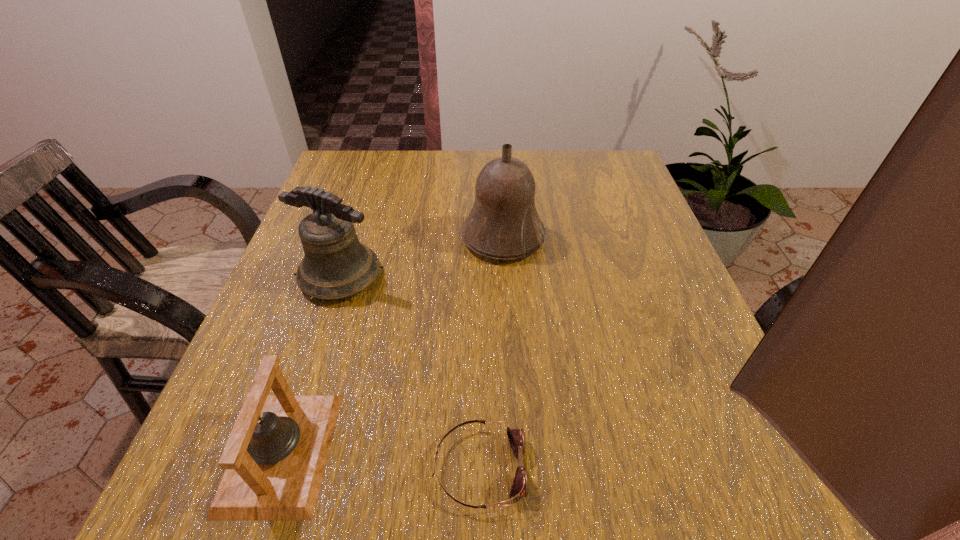
This screenshot has height=540, width=960. In order to click on free space at the far edge of the desktop in this screenshot , I will do `click(411, 183)`.

Where is `free space at the near edge of the desktop`? free space at the near edge of the desktop is located at coordinates (631, 502).

This screenshot has height=540, width=960. Identify the location of vacant space at the right edge. (613, 213).

The height and width of the screenshot is (540, 960). I want to click on vacant space at the far left corner of the desktop, so click(x=385, y=183).

This screenshot has width=960, height=540. What are the coordinates of `free space at the near left corner of the desktop` in the screenshot? It's located at (x=226, y=522).

In the image, there is a desktop. At what (x,y) coordinates should I click in order to perform the action: click on blank space at the far right corner. Please return your answer as a coordinate pair (x, y). The image size is (960, 540). Looking at the image, I should click on (568, 158).

You are a GUI agent. You are given a task and a screenshot of the screen. Output one action in this format:
    pyautogui.click(x=<x>, y=<y>)
    Task: Click on the vacant region at the near right corner of the desktop
    
    Given the screenshot: What is the action you would take?
    pyautogui.click(x=735, y=511)

The image size is (960, 540). In order to click on vacant area between the third tallest object and the rightmost bell in this screenshot , I will do `click(393, 345)`.

Where is `free space between the rightmost bell and the goggles`? The height and width of the screenshot is (540, 960). free space between the rightmost bell and the goggles is located at coordinates (492, 353).

The width and height of the screenshot is (960, 540). What are the coordinates of `vacant space that's between the rightmost bell and the nearest bell` in the screenshot? It's located at (393, 345).